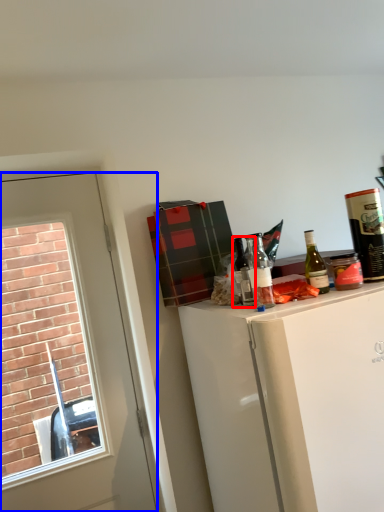
Question: Which of the following is the farthest to the observer, bottle (highlighted by a red box) or door (highlighted by a blue box)?

Choices:
 (A) bottle
 (B) door

Answer: (B)